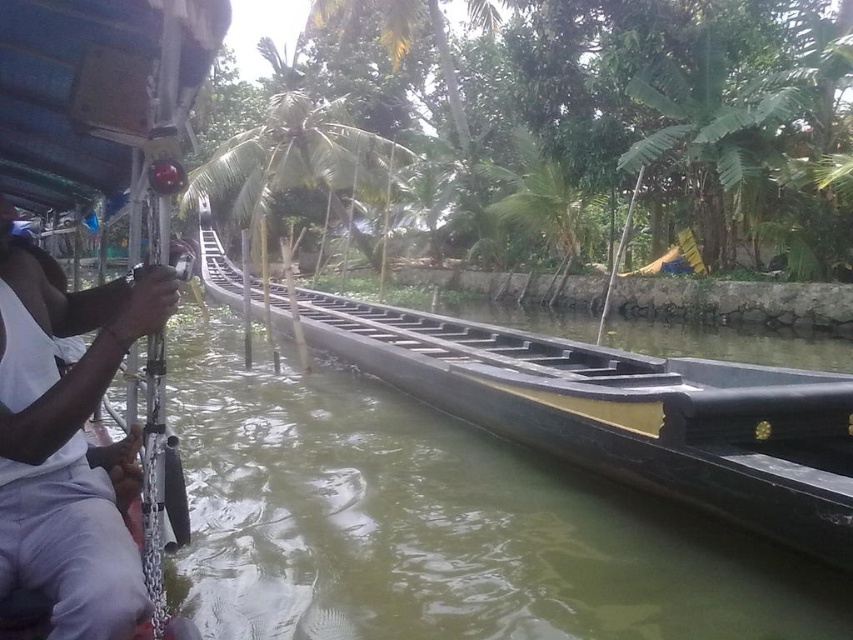
You are standing on the dock and see the black matte boat at center and the white fabric shirt at left. Which object is positioned higher in the scene?

The black matte boat at center is located above the white fabric shirt at left, so it is positioned higher in the scene.

You are standing at the point marked by the coordinate point at point (625, 412). Looking around, you see the black matte boat at center. Which direction should you face to look towards the boat?

Since the black matte boat at center is located exactly at the point marked by the coordinate point at point (625, 412), you are already standing at the same location as the boat. Therefore, you don t need to change your facing direction to look towards it.

You are standing on the dock and want to board the black matte boat at center. There is a white fabric shirt at left belonging to a person. Can you safely walk from the dock to the boat without getting too close to the person?

The black matte boat at center and white fabric shirt at left are 9.84 feet apart. Since 9.84 feet is approximately 3 meters, there is enough space to walk safely to the boat while maintaining a distance from the person wearing the white fabric shirt at left.